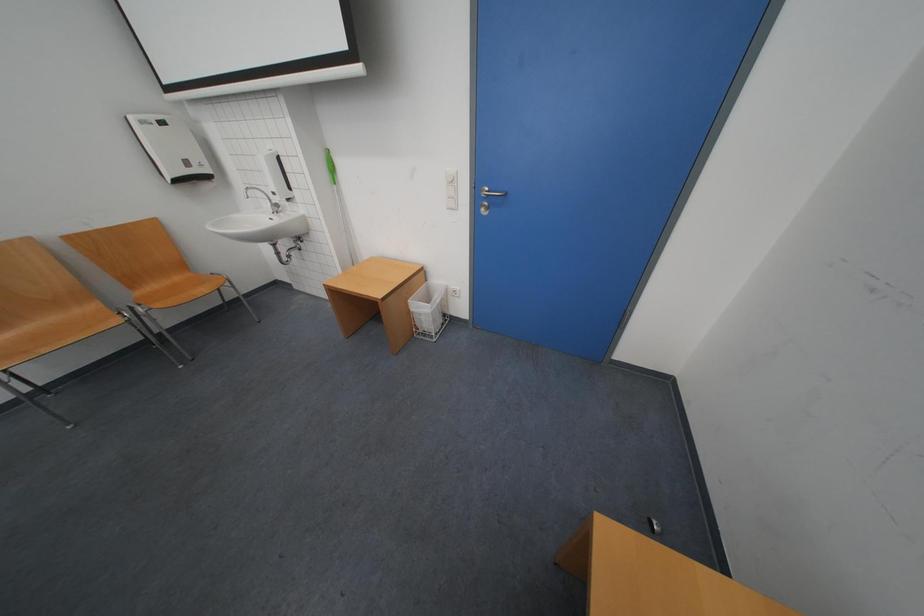
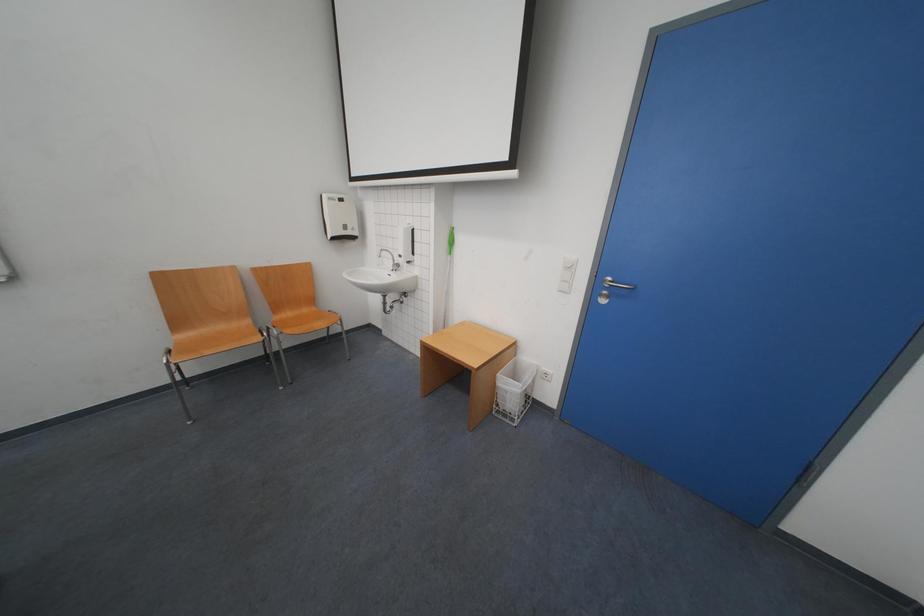
Question: What movement of the cameraman would produce the second image?

Choices:
 (A) Left
 (B) Right
 (C) Forward
 (D) Backward

Answer: (A)